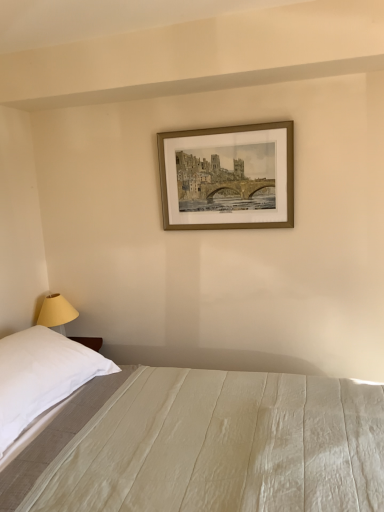
Question: Is white cotton bed at lower center inside or outside of white soft pillow at left?

Choices:
 (A) inside
 (B) outside

Answer: (B)

Question: Is point (306, 508) positioned closer to the camera than point (48, 381)?

Choices:
 (A) farther
 (B) closer

Answer: (B)

Question: Which is nearer to the white soft pillow at left?

Choices:
 (A) white cotton bed at lower center
 (B) gold metallic picture frame at upper center

Answer: (A)

Question: Based on their relative distances, which object is farther from the white soft pillow at left?

Choices:
 (A) white cotton bed at lower center
 (B) gold metallic picture frame at upper center

Answer: (B)